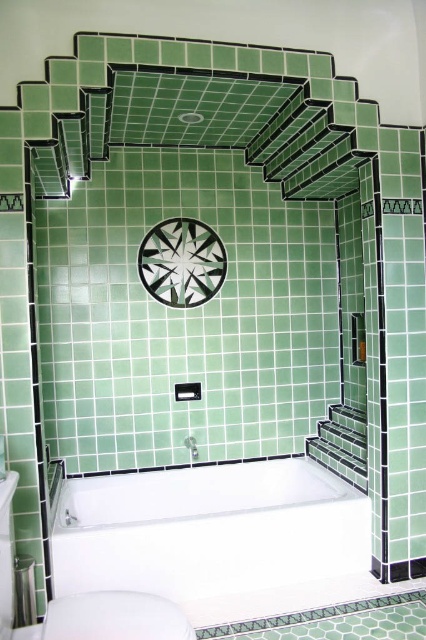
Question: Does white glossy sink at lower left appear over white glossy shower head at upper center?

Choices:
 (A) yes
 (B) no

Answer: (B)

Question: Based on their relative distances, which object is nearer to the white glossy sink at lower left?

Choices:
 (A) white glossy shower head at upper center
 (B) white glossy toilet bowl at lower center
 (C) white glossy bathtub at center

Answer: (B)

Question: Which object is positioned closest to the white glossy toilet bowl at lower center?

Choices:
 (A) white glossy shower head at upper center
 (B) white glossy sink at lower left
 (C) white glossy bathtub at center

Answer: (B)

Question: Is white glossy bathtub at center to the left of white glossy shower head at upper center from the viewer's perspective?

Choices:
 (A) yes
 (B) no

Answer: (B)

Question: Can you confirm if white glossy sink at lower left is positioned to the left of white glossy shower head at upper center?

Choices:
 (A) no
 (B) yes

Answer: (B)

Question: Which point is farther from the camera taking this photo?

Choices:
 (A) (81, 611)
 (B) (187, 442)
 (C) (25, 636)

Answer: (B)